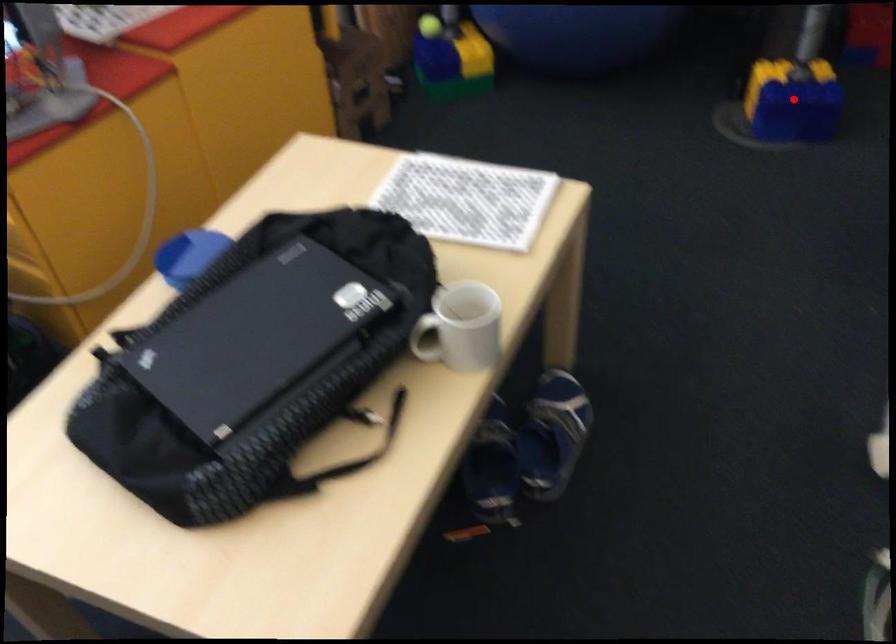
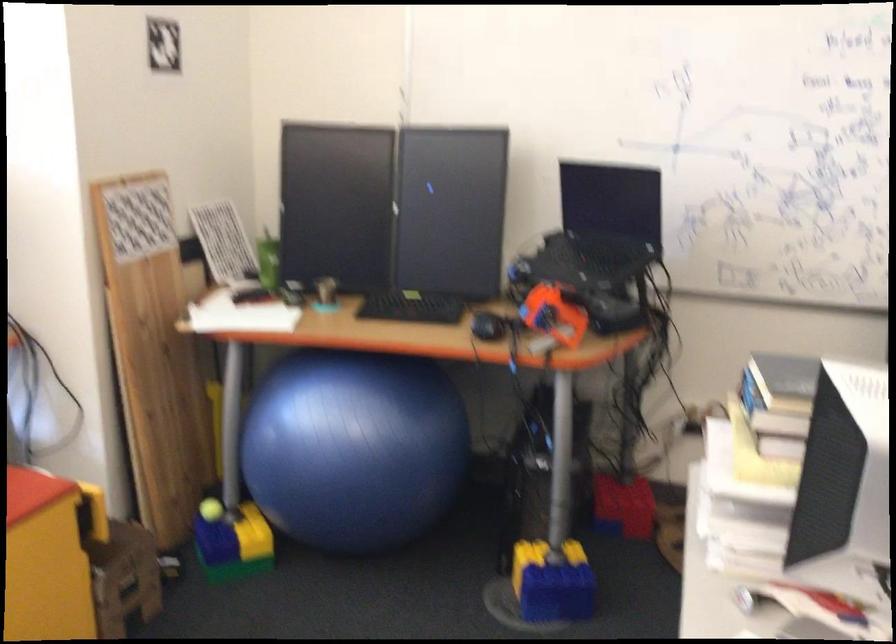
The point at the highlighted location is marked in the first image. Where is the corresponding point in the second image?

(552, 583)